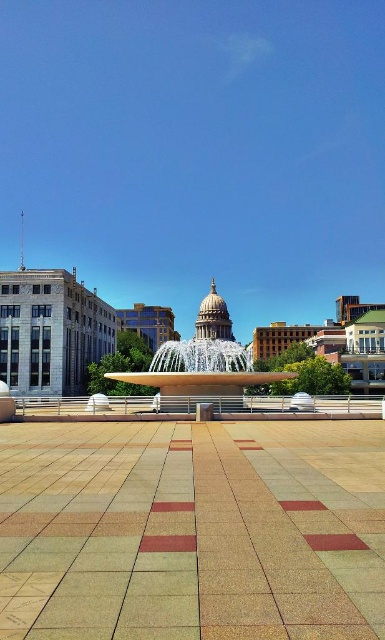
Is brown textured tiles at center to the left of white glossy fountain at center from the viewer's perspective?

Yes, brown textured tiles at center is to the left of white glossy fountain at center.

Does brown textured tiles at center have a smaller size compared to white glossy fountain at center?

Correct, brown textured tiles at center occupies less space than white glossy fountain at center.

Who is more distant from viewer, (378,515) or (152,378)?

Point (152,378)

At what (x,y) coordinates should I click in order to perform the action: click on brown textured tiles at center. Please return your answer as a coordinate pair (x, y). Image resolution: width=385 pixels, height=640 pixels. Looking at the image, I should click on (192, 531).